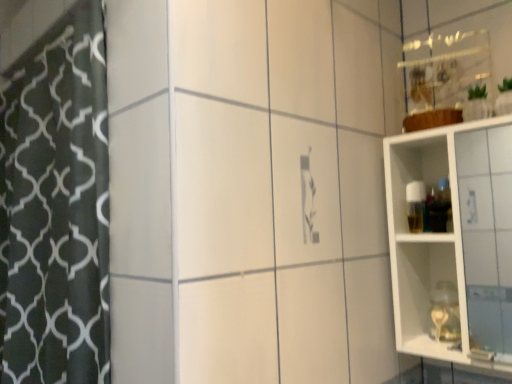
What do you see at coordinates (426, 240) in the screenshot?
I see `white glossy cabinet at right` at bounding box center [426, 240].

I want to click on white glossy cabinet at right, so click(426, 240).

You are a GUI agent. You are given a task and a screenshot of the screen. Output one action in this format:
    pyautogui.click(x=<x>, y=<y>)
    Task: Click on the white glossy cabinet at right
    
    Given the screenshot: What is the action you would take?
    pyautogui.click(x=426, y=240)